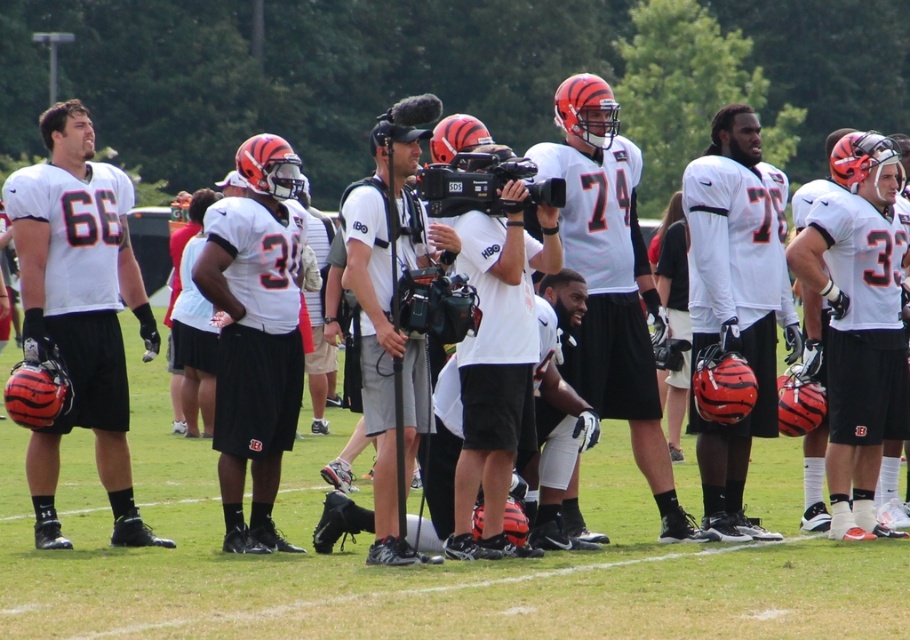
You are a photographer standing at the origin point of the field. You want to take a photo of the white matte helmet at center. According to the coordinates provided, in which direction should you move to get closer to the helmet?

The white matte helmet at center is located at coordinates point (735, 305). Since the origin is at the starting point, moving towards the positive x and y directions will bring you closer to the helmet.

You are a photographer who needs to set up a camera to capture a wide shot of the football practice. You have two cameras available, the white matte camera at center and the white fabric camera at center. Which camera should you choose if you want the one that is taller?

The white fabric camera at center is taller than the white matte camera at center, so you should choose the white fabric camera at center.